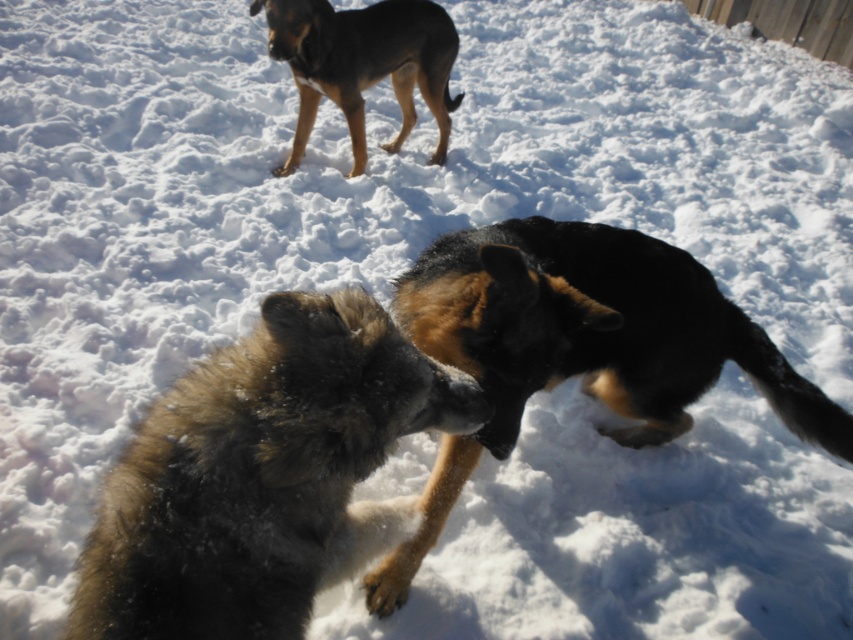
Question: Is black fur dog at center to the left of brown fur dog at upper left from the viewer's perspective?

Choices:
 (A) no
 (B) yes

Answer: (A)

Question: In this image, where is fuzzy fur dog at center located relative to black fur dog at center?

Choices:
 (A) left
 (B) right

Answer: (A)

Question: Which point is closer to the camera?

Choices:
 (A) black fur dog at center
 (B) fuzzy fur dog at center
 (C) brown fur dog at upper left

Answer: (B)

Question: Considering the real-world distances, which object is farthest from the black fur dog at center?

Choices:
 (A) fuzzy fur dog at center
 (B) brown fur dog at upper left

Answer: (B)

Question: Which point is closer to the camera?

Choices:
 (A) fuzzy fur dog at center
 (B) black fur dog at center

Answer: (A)

Question: In this image, where is fuzzy fur dog at center located relative to brown fur dog at upper left?

Choices:
 (A) left
 (B) right

Answer: (B)